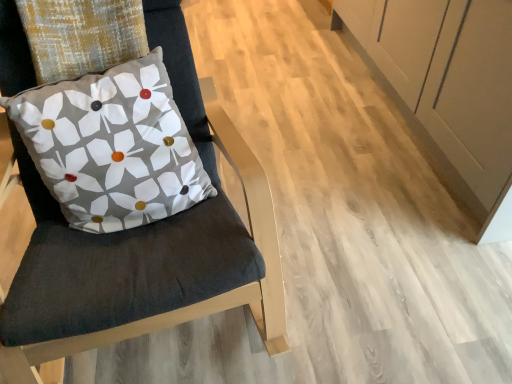
Question: Would you say matte fabric pillow at left is to the left or to the right of velvet cushion at left in the picture?

Choices:
 (A) left
 (B) right

Answer: (A)

Question: From a real-world perspective, is matte fabric pillow at left physically located above or below velvet cushion at left?

Choices:
 (A) above
 (B) below

Answer: (A)

Question: From the image's perspective, is matte fabric pillow at left located above or below velvet cushion at left?

Choices:
 (A) above
 (B) below

Answer: (A)

Question: From the image's perspective, relative to matte fabric pillow at left, is velvet cushion at left above or below?

Choices:
 (A) above
 (B) below

Answer: (B)

Question: Which is correct: velvet cushion at left is inside matte fabric pillow at left, or outside of it?

Choices:
 (A) outside
 (B) inside

Answer: (A)

Question: Would you say velvet cushion at left is to the left or to the right of matte fabric pillow at left in the picture?

Choices:
 (A) left
 (B) right

Answer: (B)

Question: Is velvet cushion at left wider or thinner than matte fabric pillow at left?

Choices:
 (A) thin
 (B) wide

Answer: (B)